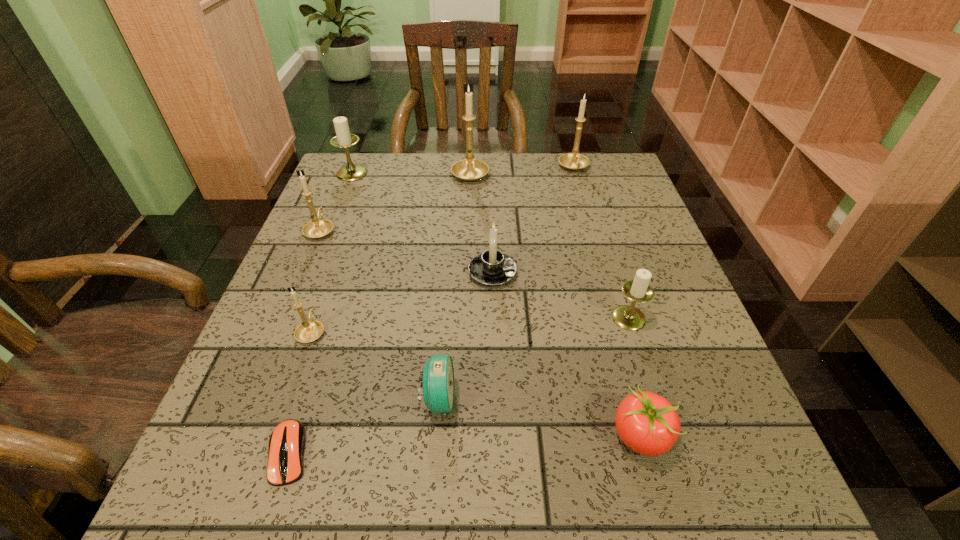
At what (x,y) coordinates should I click in order to perform the action: click on free space located 0.070m on the handle side of the fourth nearest candle holder. Please return your answer as a coordinate pair (x, y). Looking at the image, I should click on (332, 202).

Find the location of `free space located on the front of the bigger white candle holder`. free space located on the front of the bigger white candle holder is located at coordinates (310, 278).

Where is `vacant space positioned 0.170m with a handle on the side of the third nearest candle holder`? This screenshot has height=540, width=960. vacant space positioned 0.170m with a handle on the side of the third nearest candle holder is located at coordinates (596, 272).

The width and height of the screenshot is (960, 540). I want to click on vacant space located 0.250m on the handle side of the smallest gold candle holder, so click(x=345, y=237).

Locate an element on the screen. This screenshot has height=540, width=960. vacant space located 0.190m on the handle side of the smallest gold candle holder is located at coordinates (339, 254).

Locate an element on the screen. vacant area situated 0.280m on the handle side of the smallest gold candle holder is located at coordinates point(348,229).

Identify the location of free space located 0.330m on the back of the right white candle holder. (594, 209).

You are a GUI agent. You are given a task and a screenshot of the screen. Output one action in this format:
    pyautogui.click(x=<x>, y=<y>)
    Task: Click on the free spot located on the front-facing side of the alarm clock
    This screenshot has height=540, width=960.
    Given the screenshot: What is the action you would take?
    pyautogui.click(x=661, y=400)

The width and height of the screenshot is (960, 540). I want to click on free region located 0.310m on the left of the tomato, so click(410, 437).

Identify the location of free space located on the right of the orange computer mouse. The image size is (960, 540). (422, 453).